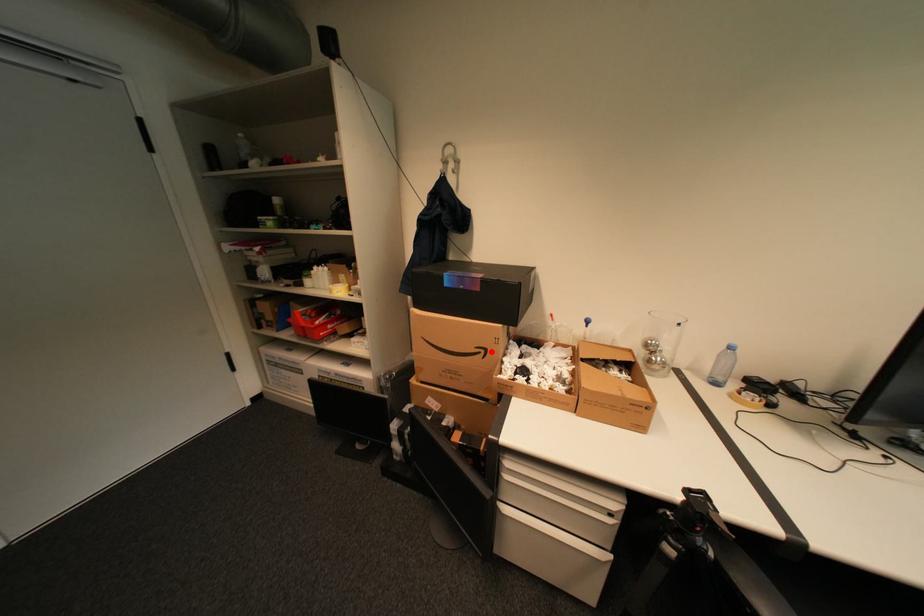
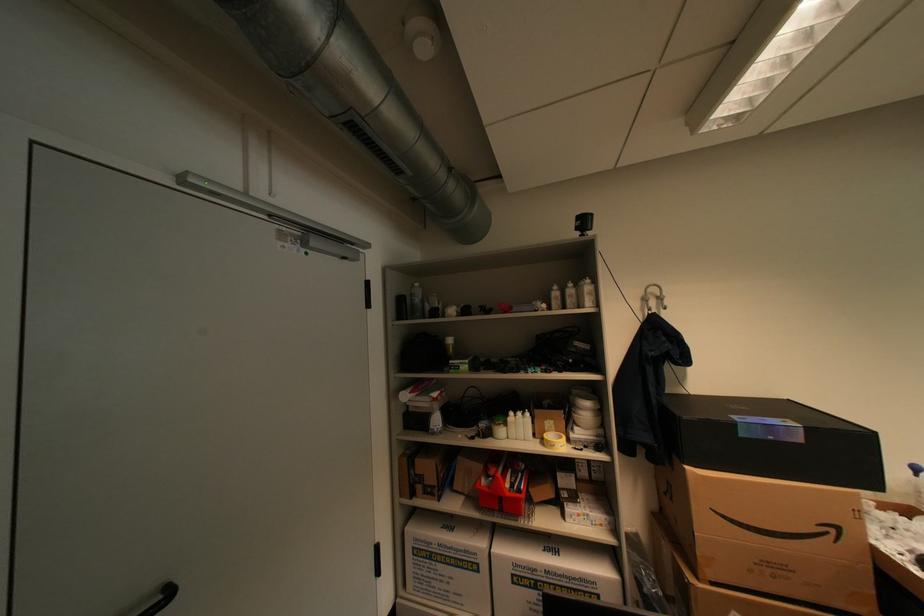
The point at the highlighted location is marked in the first image. Where is the corresponding point in the second image?

(841, 531)